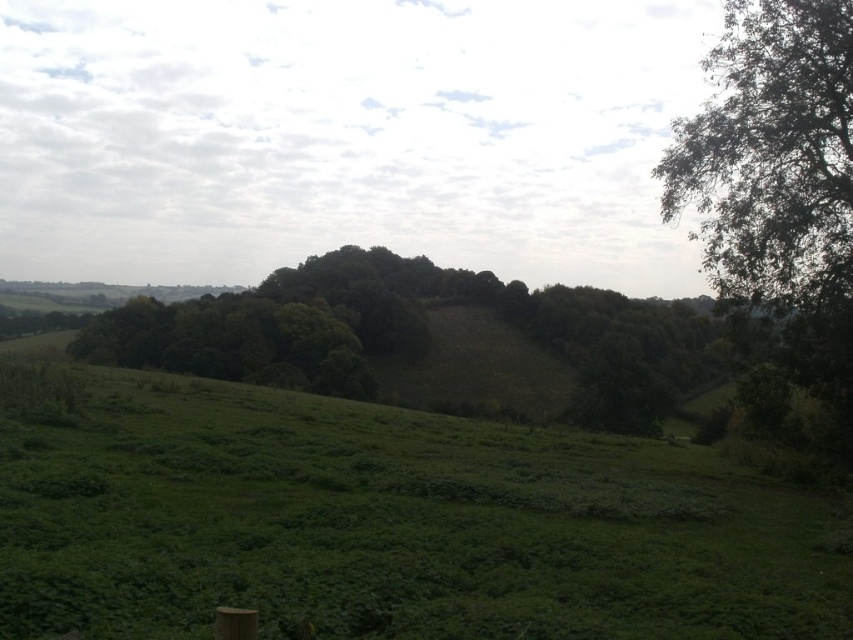
Question: Is green leafy tree at right wider than green leafy tree at center?

Choices:
 (A) yes
 (B) no

Answer: (B)

Question: Which point is farther to the camera?

Choices:
 (A) green leafy tree at center
 (B) green leafy tree at right

Answer: (A)

Question: Can you confirm if green leafy tree at right is positioned above green leafy tree at center?

Choices:
 (A) no
 (B) yes

Answer: (B)

Question: Which point is closer to the camera?

Choices:
 (A) green leafy tree at right
 (B) green leafy tree at center

Answer: (A)

Question: Does green leafy tree at right appear on the right side of green leafy tree at center?

Choices:
 (A) no
 (B) yes

Answer: (B)